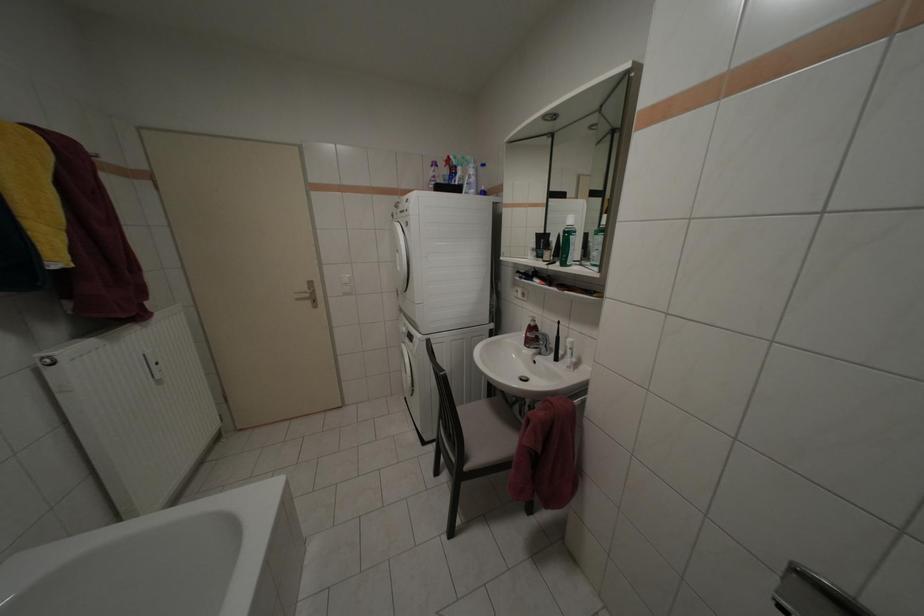
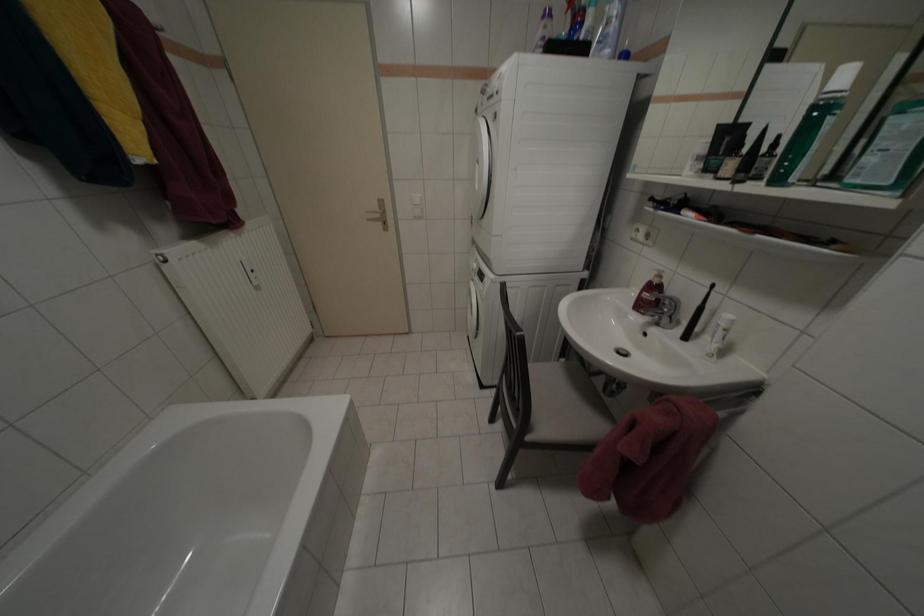
Question: How did the camera likely rotate?

Choices:
 (A) Left
 (B) Right
 (C) Up
 (D) Down

Answer: (D)